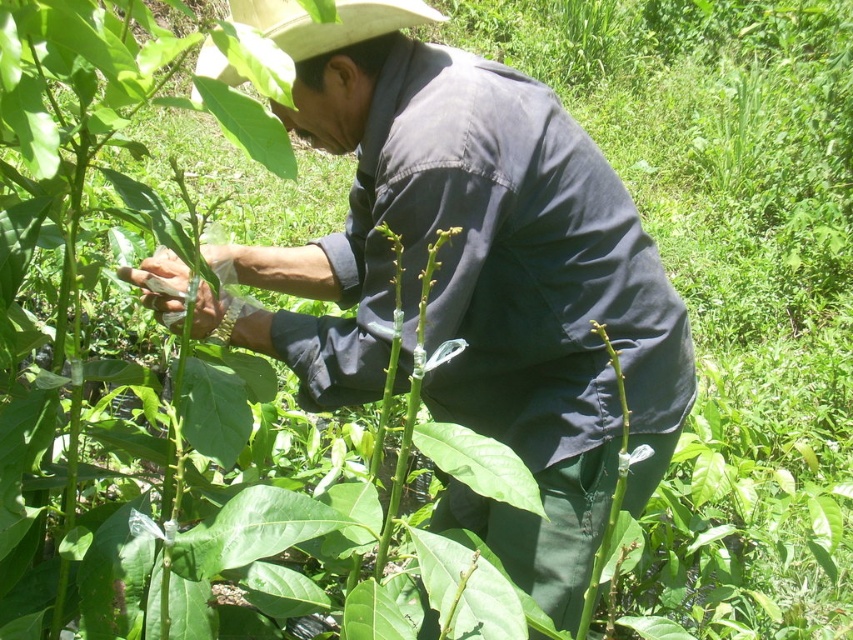
Question: Which object is closer to the camera taking this photo?

Choices:
 (A) white straw cowboy hat at upper center
 (B) dark blue shirt at center

Answer: (A)

Question: Is dark blue shirt at center to the left of white straw cowboy hat at upper center from the viewer's perspective?

Choices:
 (A) no
 (B) yes

Answer: (A)

Question: Can you confirm if dark blue shirt at center is positioned to the left of white straw cowboy hat at upper center?

Choices:
 (A) no
 (B) yes

Answer: (A)

Question: In this image, where is dark blue shirt at center located relative to white straw cowboy hat at upper center?

Choices:
 (A) below
 (B) above

Answer: (A)

Question: Which point is closer to the camera?

Choices:
 (A) (309, 28)
 (B) (572, 438)

Answer: (A)

Question: Which point is closer to the camera?

Choices:
 (A) dark blue shirt at center
 (B) white straw cowboy hat at upper center

Answer: (B)